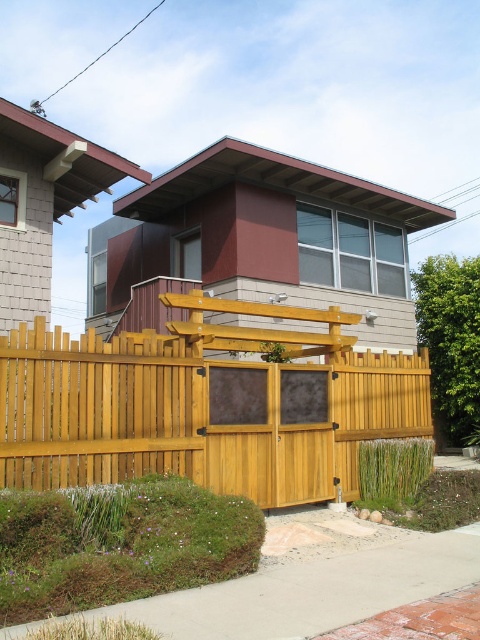
Can you confirm if light brown wood fence at center is shorter than green grass at lower left?

No, light brown wood fence at center is not shorter than green grass at lower left.

Does point (56, 449) come behind point (58, 516)?

Yes, point (56, 449) is behind point (58, 516).

I want to click on light brown wood fence at center, so click(x=204, y=404).